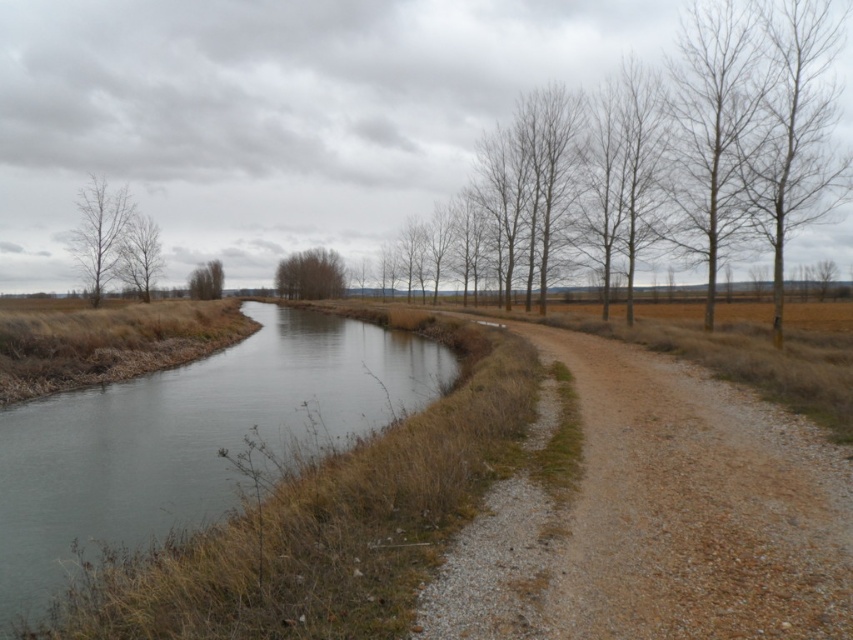
Question: Which of the following is the closest to the observer?

Choices:
 (A) (206, 292)
 (B) (79, 196)

Answer: (B)

Question: Among these objects, which one is farthest from the camera?

Choices:
 (A) green leafy tree at upper center
 (B) bare wood tree at left

Answer: (A)

Question: Can you confirm if brown grassy stream at left is thinner than bare wood tree at left?

Choices:
 (A) no
 (B) yes

Answer: (A)

Question: In this image, where is bare wood tree at left located relative to green leafy tree at upper center?

Choices:
 (A) below
 (B) above

Answer: (A)

Question: Does brown grassy stream at left appear under green leafy tree at upper center?

Choices:
 (A) no
 (B) yes

Answer: (B)

Question: Which point appears farthest from the camera in this image?

Choices:
 (A) click(x=117, y=225)
 (B) click(x=155, y=432)
 (C) click(x=132, y=248)

Answer: (C)